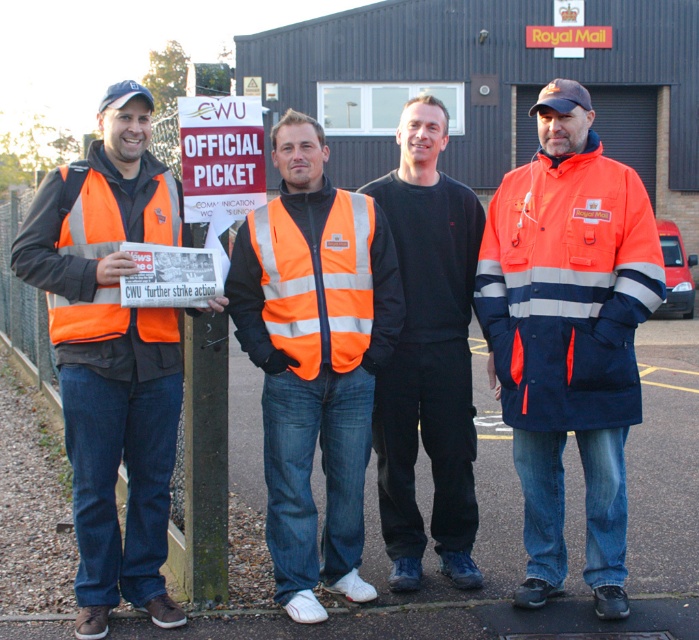
Question: Can you confirm if orange high-visibility vest at center is thinner than high visibility orange safety vest at left?

Choices:
 (A) no
 (B) yes

Answer: (A)

Question: Which of these objects is positioned farthest from the orange high-visibility vest at center?

Choices:
 (A) orange reflective jacket at center
 (B) black cotton shirt at center
 (C) matte orange vest at left
 (D) high-visibility fabric safety vest at center

Answer: (A)

Question: Is matte orange vest at left further to camera compared to high visibility orange safety vest at left?

Choices:
 (A) no
 (B) yes

Answer: (A)

Question: Is black cotton shirt at center positioned at the back of high-visibility fabric safety vest at center?

Choices:
 (A) yes
 (B) no

Answer: (A)

Question: Which object appears farthest from the camera in this image?

Choices:
 (A) high-visibility fabric safety vest at center
 (B) orange high-visibility vest at center
 (C) matte orange vest at left
 (D) black cotton shirt at center

Answer: (D)

Question: Among these objects, which one is farthest from the camera?

Choices:
 (A) high visibility orange safety vest at left
 (B) black cotton shirt at center
 (C) high-visibility fabric safety vest at center
 (D) orange high-visibility vest at center

Answer: (B)